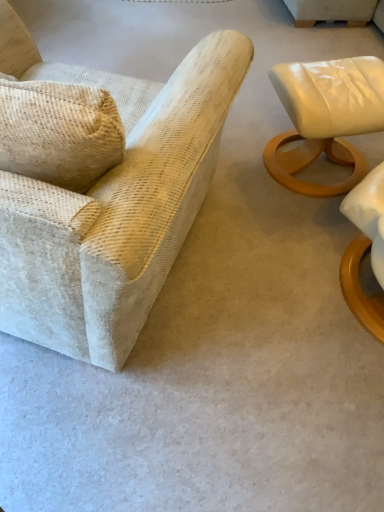
This screenshot has width=384, height=512. Identify the location of free space to the left of matte white leather ottoman at right, the second chair viewed from the left. (236, 165).